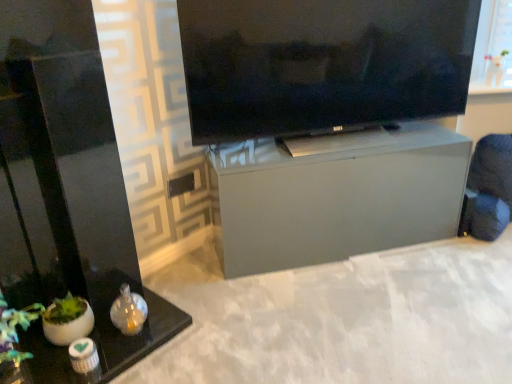
You are a GUI agent. You are given a task and a screenshot of the screen. Output one action in this format:
    pyautogui.click(x=<x>, y=<y>)
    Task: Click on the vacant space that's between satin gray cabinet at center, the first furniture when ordered from right to left, and black glass table at lower left, the 2th furniture when ordered from right to left
    The width and height of the screenshot is (512, 384).
    Given the screenshot: What is the action you would take?
    pyautogui.click(x=257, y=294)